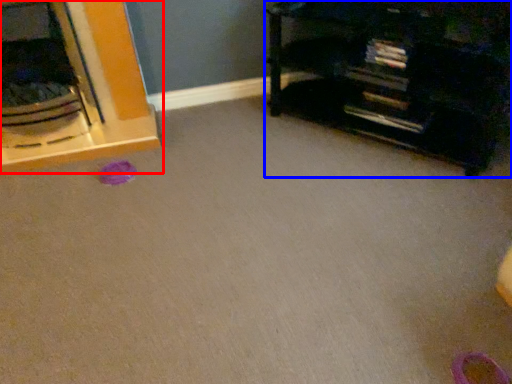
Question: Among these objects, which one is nearest to the camera, furniture (highlighted by a red box) or furniture (highlighted by a blue box)?

Choices:
 (A) furniture
 (B) furniture

Answer: (B)